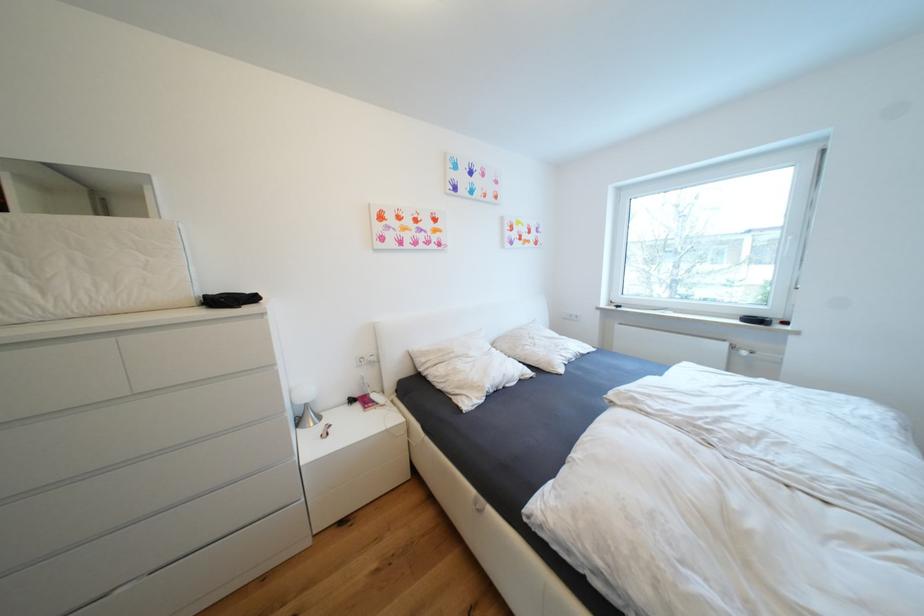
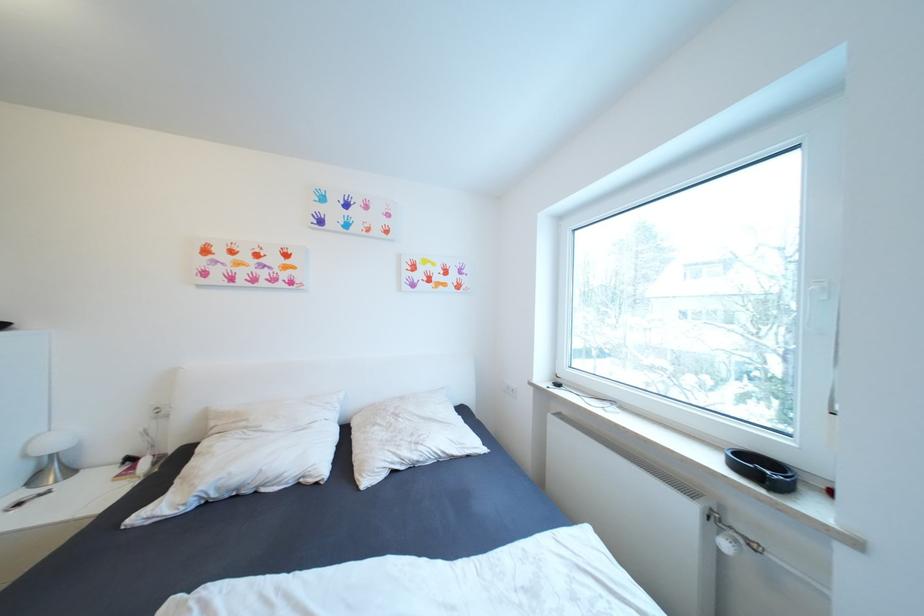
Locate, in the second image, the point that corresponds to (763,322) in the first image.

(769, 471)